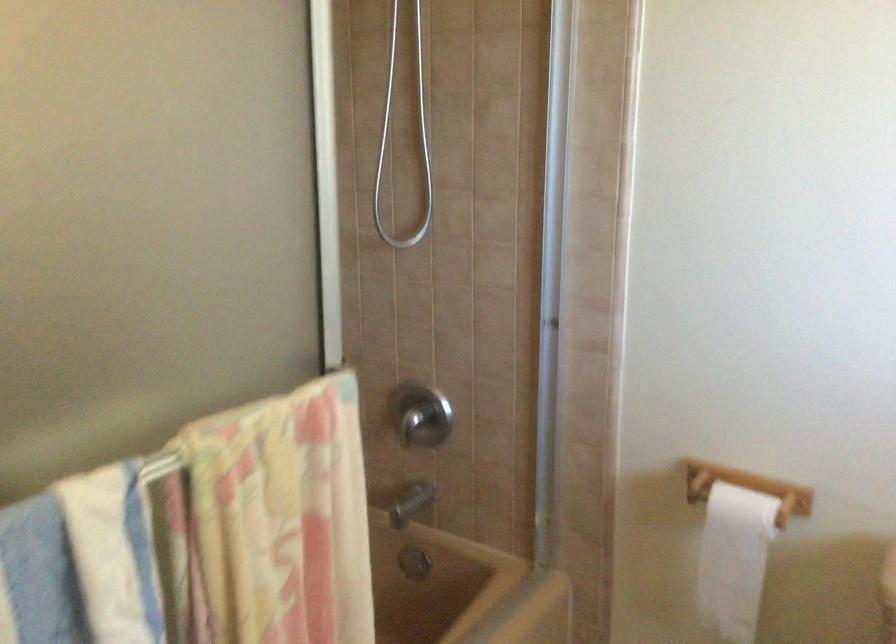
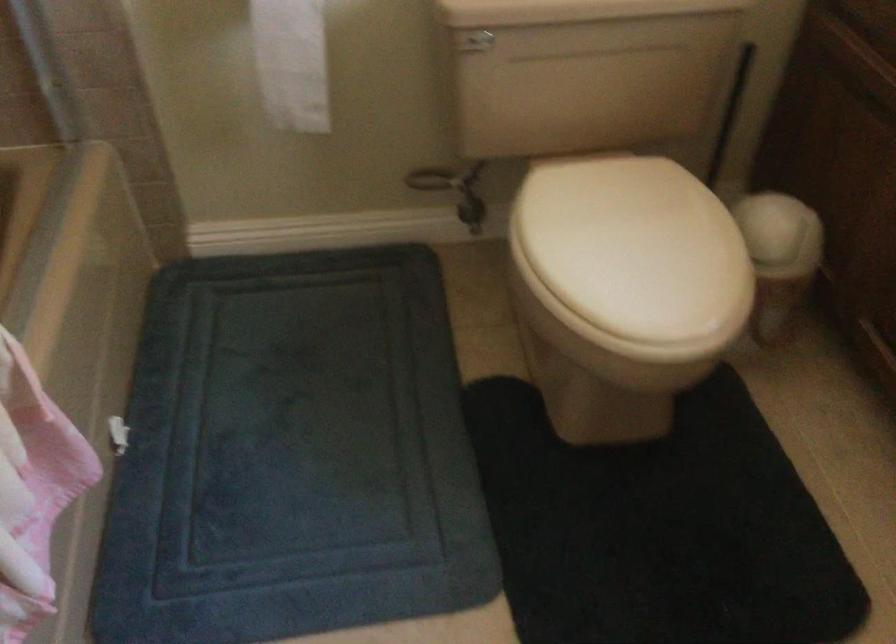
The images are taken continuously from a first-person perspective. In which direction is your viewpoint rotating?

The rotation direction of the camera is right-down.